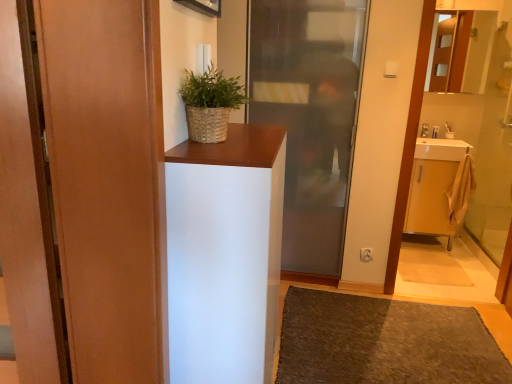
Question: Is brown textured rug at lower center at the back of white matte cabinet at center?

Choices:
 (A) no
 (B) yes

Answer: (A)

Question: From a real-world perspective, is white matte cabinet at center on brown textured rug at lower center?

Choices:
 (A) yes
 (B) no

Answer: (A)

Question: Is there a large distance between white matte cabinet at center and brown textured rug at lower center?

Choices:
 (A) yes
 (B) no

Answer: (A)

Question: Is white matte cabinet at center further to the viewer compared to brown textured rug at lower center?

Choices:
 (A) no
 (B) yes

Answer: (A)

Question: From a real-world perspective, is white matte cabinet at center located beneath brown textured rug at lower center?

Choices:
 (A) yes
 (B) no

Answer: (B)

Question: Visually, is white matte cabinet at center positioned to the left or to the right of white plastic toothbrush at upper right?

Choices:
 (A) left
 (B) right

Answer: (A)

Question: From the image's perspective, is white matte cabinet at center above or below white plastic toothbrush at upper right?

Choices:
 (A) above
 (B) below

Answer: (B)

Question: Considering the positions of point (199, 337) and point (425, 125), is point (199, 337) closer or farther from the camera than point (425, 125)?

Choices:
 (A) farther
 (B) closer

Answer: (B)

Question: Is white matte cabinet at center taller or shorter than white plastic toothbrush at upper right?

Choices:
 (A) tall
 (B) short

Answer: (A)

Question: Looking at the image, does transparent glass door at center, the first door in the right-to-left sequence, seem bigger or smaller compared to white plastic toothbrush at upper right?

Choices:
 (A) small
 (B) big

Answer: (B)

Question: In the image, is transparent glass door at center, which is the 1th door in back-to-front order, positioned in front of or behind white plastic toothbrush at upper right?

Choices:
 (A) behind
 (B) front

Answer: (B)

Question: From a real-world perspective, is transparent glass door at center, placed as the 2th door when sorted from left to right, physically located above or below white plastic toothbrush at upper right?

Choices:
 (A) above
 (B) below

Answer: (B)

Question: From the image's perspective, is transparent glass door at center, the first door in the right-to-left sequence, above or below white plastic toothbrush at upper right?

Choices:
 (A) below
 (B) above

Answer: (A)

Question: From the image's perspective, is brown textured rug at lower center above or below woven brown basket at upper center?

Choices:
 (A) below
 (B) above

Answer: (A)

Question: Looking at their shapes, would you say brown textured rug at lower center is wider or thinner than woven brown basket at upper center?

Choices:
 (A) thin
 (B) wide

Answer: (B)